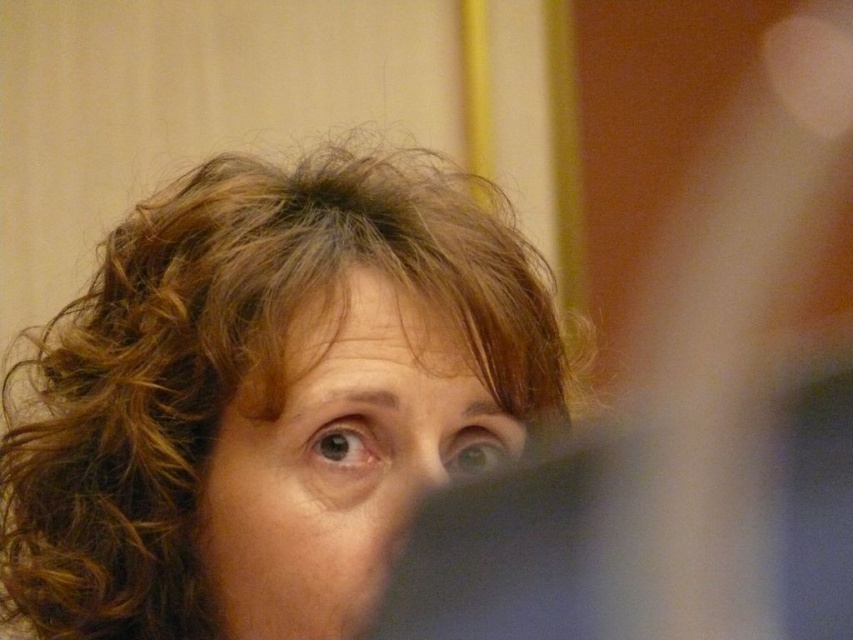
Question: Which point is closer to the camera taking this photo?

Choices:
 (A) (241, 304)
 (B) (425, 477)

Answer: (B)

Question: Which point is farther to the camera?

Choices:
 (A) smooth skin face at center
 (B) curly brown hair at upper center

Answer: (A)

Question: Can you confirm if curly brown hair at upper center is positioned above smooth skin face at center?

Choices:
 (A) no
 (B) yes

Answer: (B)

Question: In this image, where is curly brown hair at upper center located relative to smooth skin face at center?

Choices:
 (A) below
 (B) above

Answer: (B)

Question: Which point is closer to the camera?

Choices:
 (A) curly brown hair at upper center
 (B) smooth skin face at center

Answer: (A)

Question: Can you confirm if curly brown hair at upper center is thinner than smooth skin face at center?

Choices:
 (A) no
 (B) yes

Answer: (A)